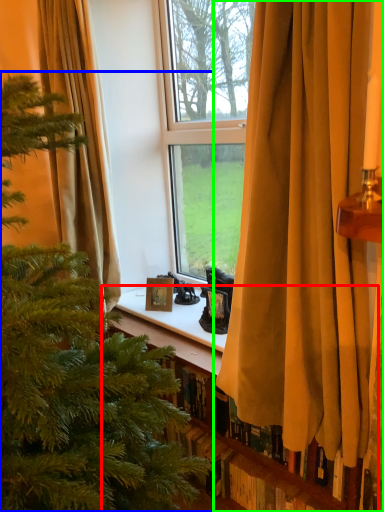
Question: Estimate the real-world distances between objects in this image. Which object is farther from bookshelf (highlighted by a red box), christmas tree (highlighted by a blue box) or curtain (highlighted by a green box)?

Choices:
 (A) christmas tree
 (B) curtain

Answer: (A)